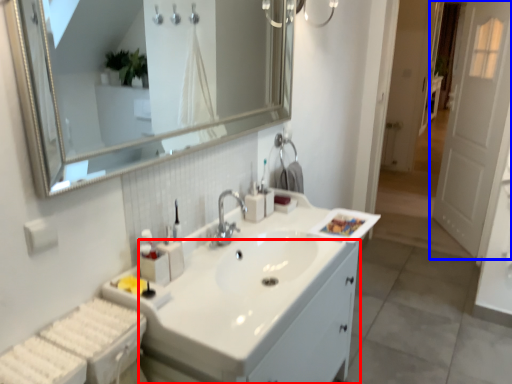
Question: Which object appears farthest to the camera in this image, bathroom cabinet (highlighted by a red box) or door (highlighted by a blue box)?

Choices:
 (A) bathroom cabinet
 (B) door

Answer: (B)